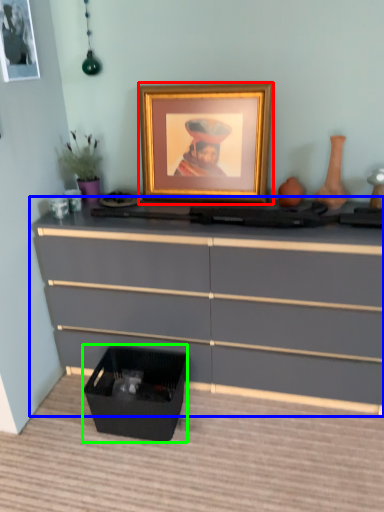
Question: Which object is the closest to the picture frame (highlighted by a red box)? Choose among these: chest of drawers (highlighted by a blue box) or storage box (highlighted by a green box).

Choices:
 (A) chest of drawers
 (B) storage box

Answer: (A)